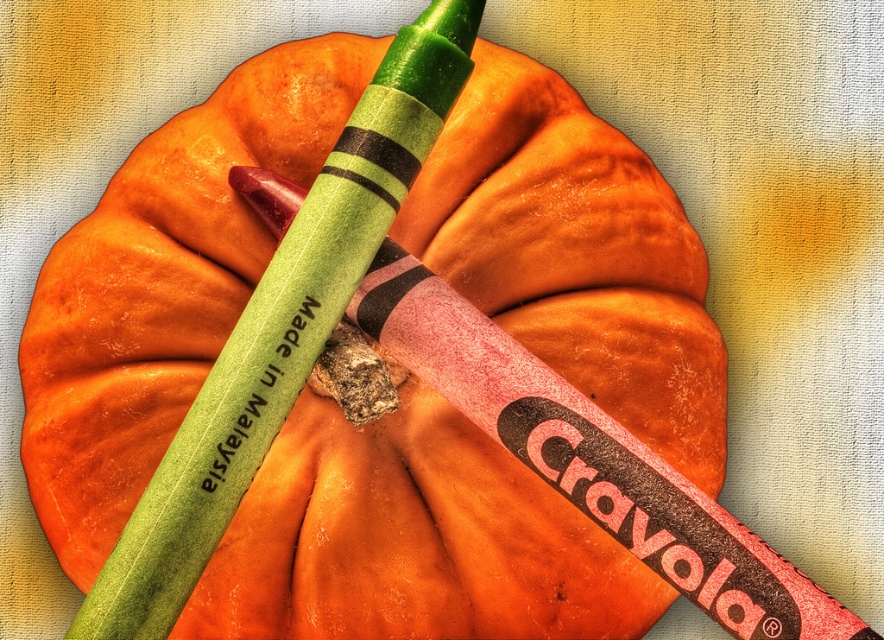
You are holding a camera and want to take a photo of the pumpkin with the two Crayola crayons. The camera has a focus range of 75 to 80 centimeters. Will the point at point (362,237) be in focus?

The point at point (362,237) is 76.74 centimeters from the camera, which falls within the focus range of 75 to 80 centimeters. Therefore, the point will be in focus.

You are an artist trying to place a new sticker on the pumpkin. The sticker is smaller than the space between the green matte crayon at upper center and the black matte text at center. Where should you place the sticker to ensure it doesn t interfere with either object?

The sticker should be placed between the green matte crayon at upper center and the black matte text at center since the space there is larger than the sticker s size, ensuring it doesn t interfere with either object.

You are an artist trying to place a small sticker exactly between the green matte crayon at upper center and the black matte text at center. Which object should you position the sticker closer to?

The sticker should be positioned closer to the black matte text at center because the green matte crayon at upper center has a greater height and thus is farther away from the text.